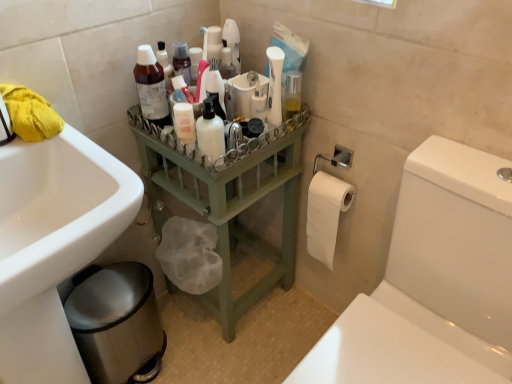
Question: Relative to metallic silver bidet at lower left, is white matte lotion bottle at center in front or behind?

Choices:
 (A) front
 (B) behind

Answer: (A)

Question: Is white matte lotion bottle at center to the left or to the right of metallic silver bidet at lower left in the image?

Choices:
 (A) right
 (B) left

Answer: (A)

Question: Estimate the real-world distances between objects in this image. Which object is farther from the white matte pump bottle at center, which ranks as the 2th cleaning product in left-to-right order?

Choices:
 (A) green painted wood at center
 (B) white matte toilet paper at right
 (C) white matte lotion bottle at center
 (D) metallic silver bidet at lower left
 (E) white glossy bottle at upper center, the first cleaning product from the right

Answer: (D)

Question: Considering the real-world distances, which object is farthest from the green painted wood at center?

Choices:
 (A) yellow fabric at upper left
 (B) metallic silver bidet at lower left
 (C) white matte lotion bottle at center
 (D) white glossy toilet at right
 (E) white glossy bottle at upper center, the first cleaning product from the right

Answer: (A)